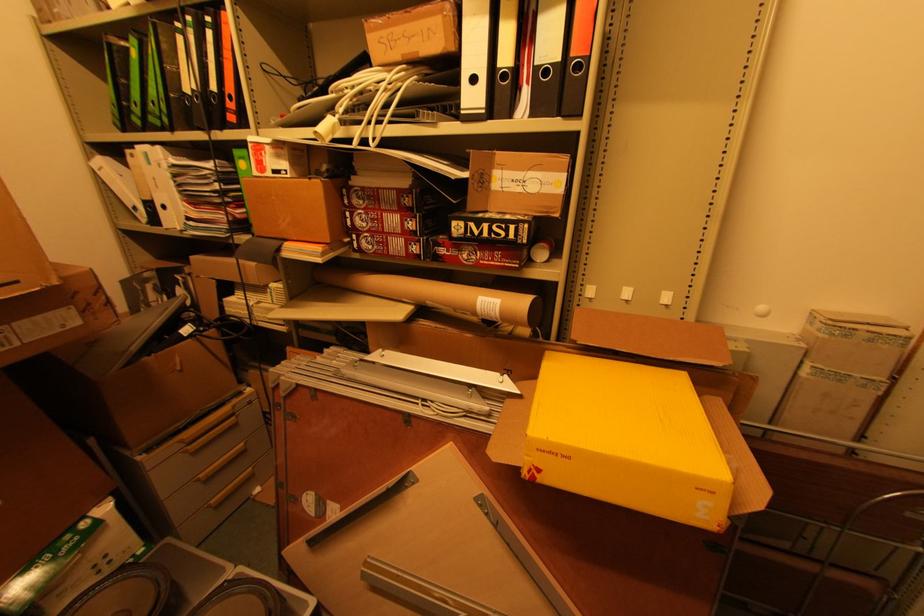
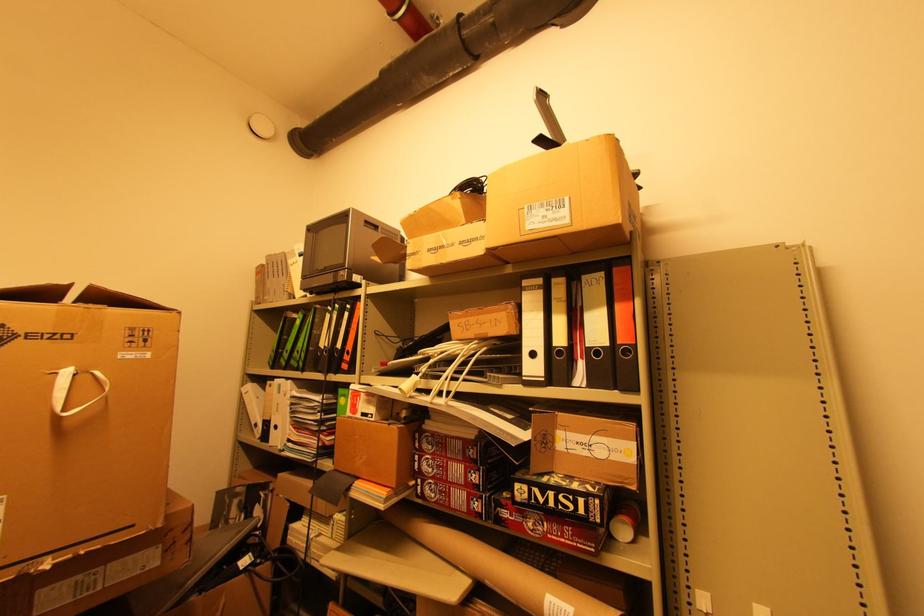
Locate, in the second image, the point that corresponds to point 502,227 in the first image.

(568, 498)